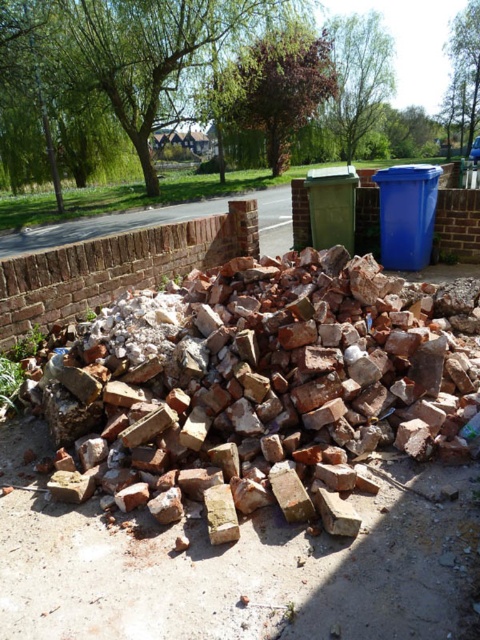
Is the position of blue plastic bin at right less distant than that of green plastic bin at center?

Yes, blue plastic bin at right is in front of green plastic bin at center.

Is point (422, 188) closer to camera compared to point (350, 188)?

Yes, point (422, 188) is in front of point (350, 188).

Locate an element on the screen. The image size is (480, 640). blue plastic bin at right is located at coordinates (407, 214).

This screenshot has width=480, height=640. Find the location of `blue plastic bin at right`. blue plastic bin at right is located at coordinates (407, 214).

Who is more distant from viewer, [287,509] or [322,179]?

Point [322,179]

Is brown rough bricks at center to the left of green plastic bin at center from the viewer's perspective?

Indeed, brown rough bricks at center is positioned on the left side of green plastic bin at center.

Where is `brown rough bricks at center`? brown rough bricks at center is located at coordinates (264, 387).

The height and width of the screenshot is (640, 480). Find the location of `brown rough bricks at center`. brown rough bricks at center is located at coordinates [264, 387].

Between brown rough bricks at center and blue plastic bin at right, which one has less height?

With less height is brown rough bricks at center.

Does point (204, 396) come closer to viewer compared to point (385, 228)?

Yes, point (204, 396) is closer to viewer.

At what (x,y) coordinates should I click in order to perform the action: click on brown rough bricks at center. Please return your answer as a coordinate pair (x, y). Image resolution: width=480 pixels, height=640 pixels. Looking at the image, I should click on (264, 387).